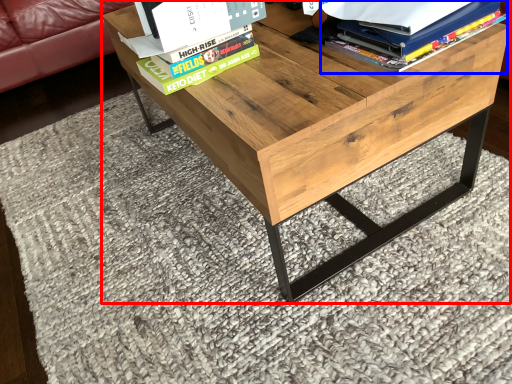
Question: Which of the following is the farthest to the observer, table (highlighted by a red box) or book (highlighted by a blue box)?

Choices:
 (A) table
 (B) book

Answer: (B)